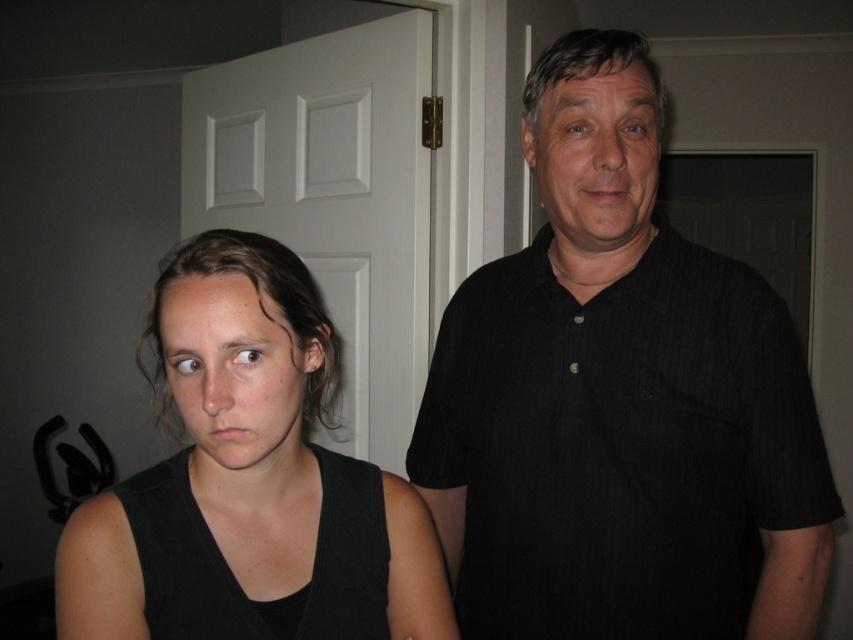
Question: Which point is closer to the camera?

Choices:
 (A) matte black face at left
 (B) smooth black shirt at center
 (C) matte black tank top at left

Answer: (A)

Question: From the image, what is the correct spatial relationship of black striped shirt at center in relation to smooth black shirt at center?

Choices:
 (A) left
 (B) right

Answer: (B)

Question: Can you confirm if matte black tank top at left is thinner than matte black face at left?

Choices:
 (A) yes
 (B) no

Answer: (B)

Question: Which of the following is the farthest from the observer?

Choices:
 (A) smooth black shirt at center
 (B) black striped shirt at center
 (C) matte black face at left

Answer: (B)

Question: Considering the relative positions of matte black face at left and smooth black shirt at center in the image provided, where is matte black face at left located with respect to smooth black shirt at center?

Choices:
 (A) below
 (B) above

Answer: (A)

Question: Which is nearer to the black striped shirt at center?

Choices:
 (A) matte black tank top at left
 (B) smooth black shirt at center

Answer: (B)